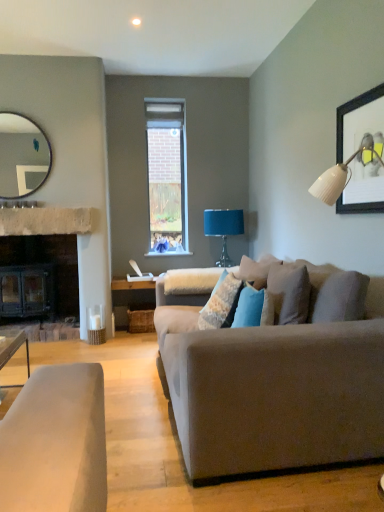
Question: Are matte silver mirror at upper left and suede couch at center making contact?

Choices:
 (A) yes
 (B) no

Answer: (B)

Question: Is matte silver mirror at upper left shorter than suede couch at center?

Choices:
 (A) no
 (B) yes

Answer: (B)

Question: Is suede couch at center at the back of matte silver mirror at upper left?

Choices:
 (A) no
 (B) yes

Answer: (A)

Question: Does matte silver mirror at upper left lie behind suede couch at center?

Choices:
 (A) yes
 (B) no

Answer: (A)

Question: Is matte silver mirror at upper left taller than suede couch at center?

Choices:
 (A) no
 (B) yes

Answer: (A)

Question: Is matte silver mirror at upper left bigger than suede couch at center?

Choices:
 (A) no
 (B) yes

Answer: (A)

Question: Would you say teal fabric lampshade at upper right is part of wooden framed artwork at upper right's contents?

Choices:
 (A) no
 (B) yes

Answer: (A)

Question: From a real-world perspective, is wooden framed artwork at upper right beneath teal fabric lampshade at upper right?

Choices:
 (A) yes
 (B) no

Answer: (B)

Question: Is wooden framed artwork at upper right turned away from teal fabric lampshade at upper right?

Choices:
 (A) yes
 (B) no

Answer: (B)

Question: From the image's perspective, does wooden framed artwork at upper right appear lower than teal fabric lampshade at upper right?

Choices:
 (A) no
 (B) yes

Answer: (A)

Question: Can you confirm if wooden framed artwork at upper right is wider than teal fabric lampshade at upper right?

Choices:
 (A) no
 (B) yes

Answer: (A)

Question: Can you confirm if wooden framed artwork at upper right is positioned to the left of teal fabric lampshade at upper right?

Choices:
 (A) no
 (B) yes

Answer: (A)

Question: Does wooden framed artwork at upper right come in front of matte silver mirror at upper left?

Choices:
 (A) no
 (B) yes

Answer: (B)